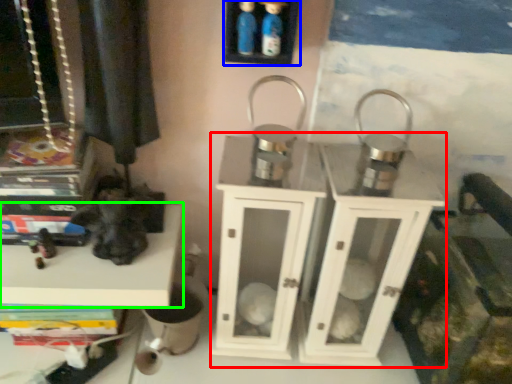
Question: Based on their relative distances, which object is nearer to dresser (highlighted by a red box)? Choose from shelf (highlighted by a blue box) and shelf (highlighted by a green box).

Choices:
 (A) shelf
 (B) shelf

Answer: (B)